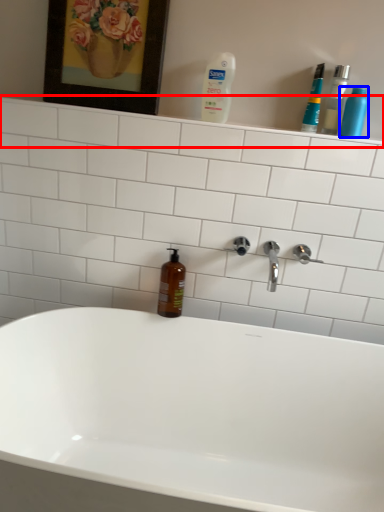
Question: Which object is closer to the camera taking this photo, shelve (highlighted by a red box) or cleaning product (highlighted by a blue box)?

Choices:
 (A) shelve
 (B) cleaning product

Answer: (B)